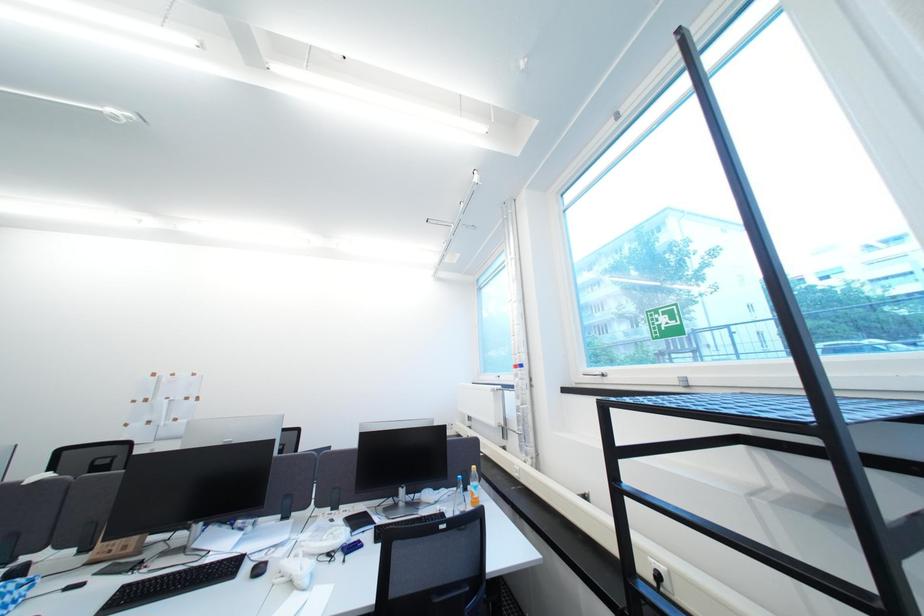
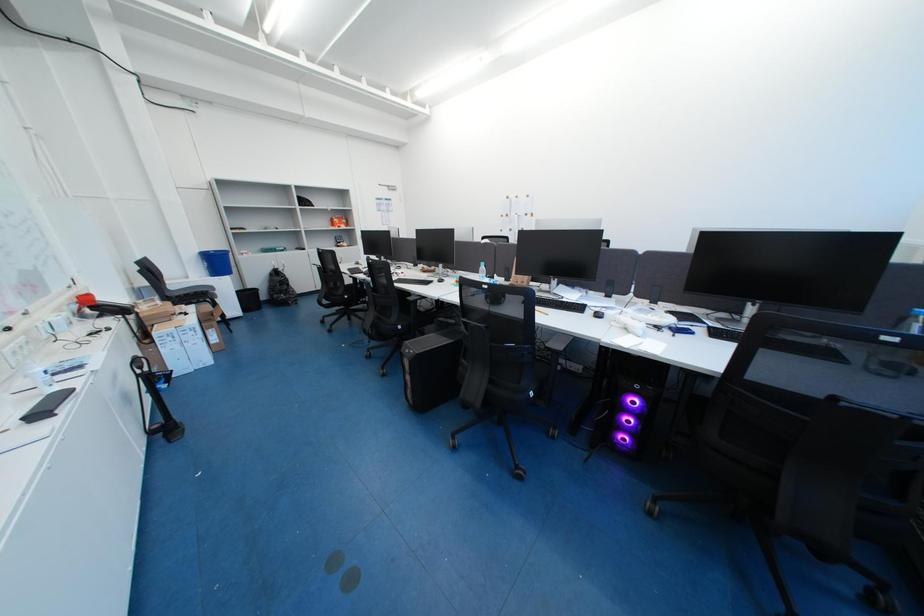
First-person continuous shooting, in which direction is the camera rotating?

The rotation direction of the camera is left-down.